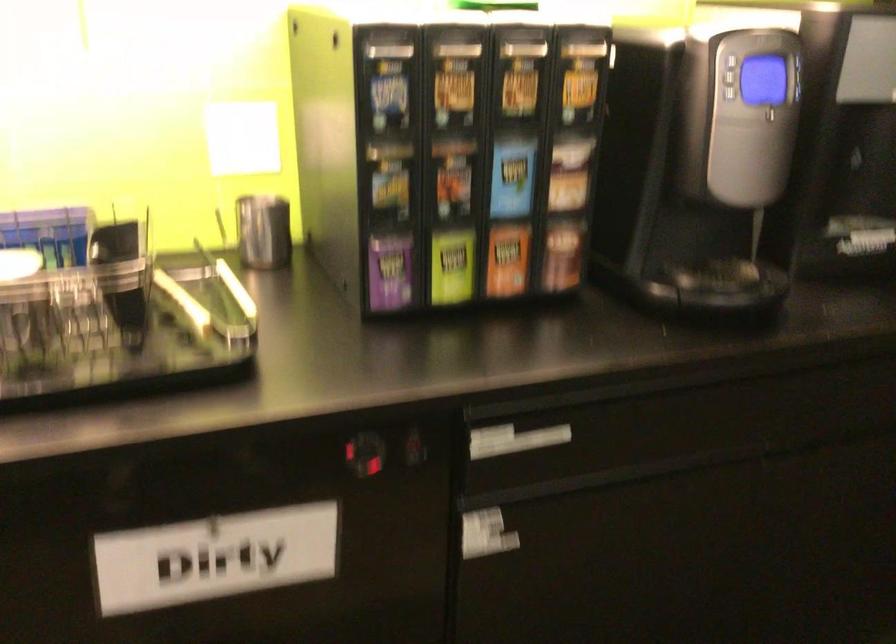
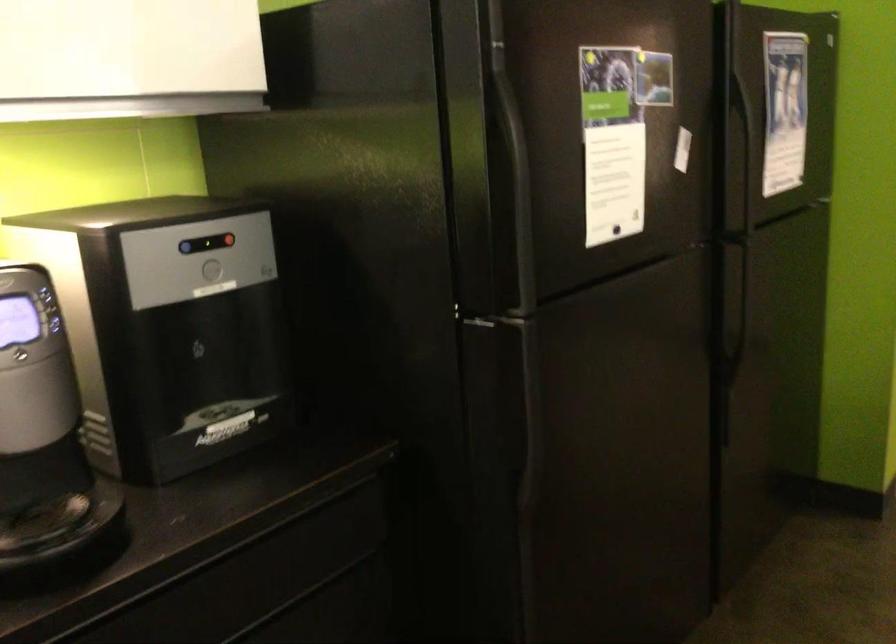
Question: In a continuous first-person perspective shot, in which direction is the camera moving?

Choices:
 (A) Left
 (B) Right
 (C) Forward
 (D) Backward

Answer: (B)